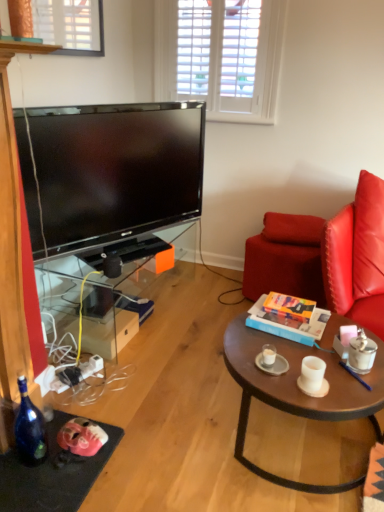
The width and height of the screenshot is (384, 512). Find the location of `free region on the left part of black plastic pen at center`. free region on the left part of black plastic pen at center is located at coordinates (327, 360).